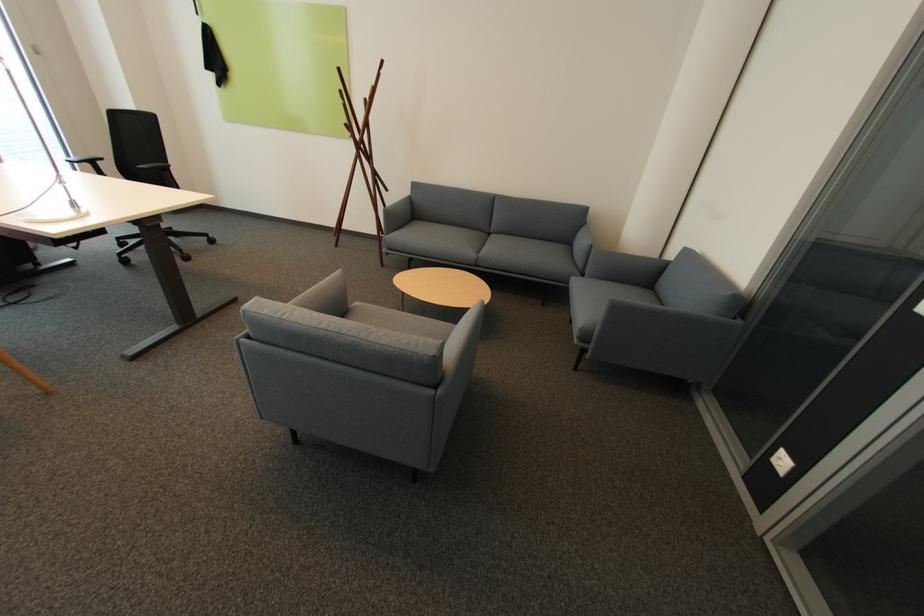
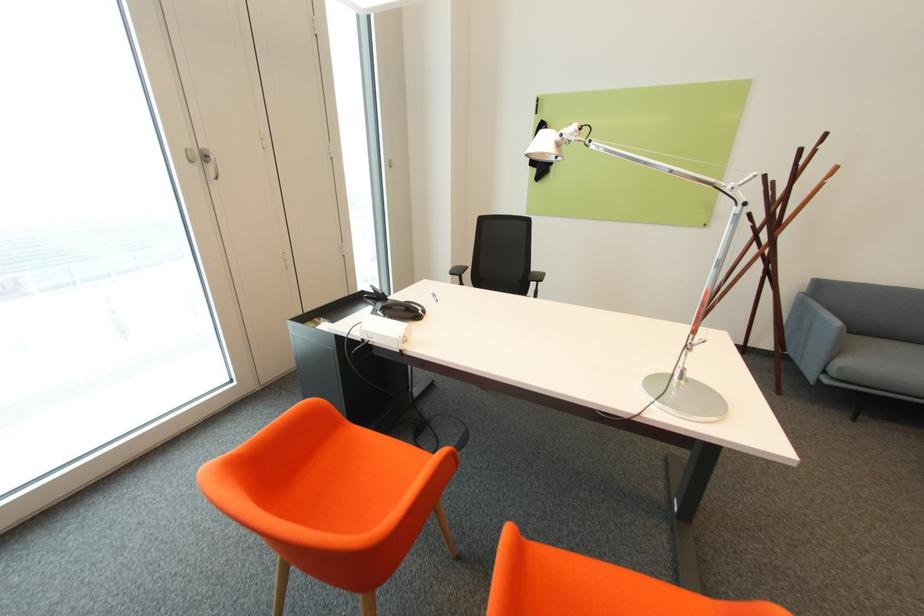
Question: The images are taken continuously from a first-person perspective. In which direction are you moving?

Choices:
 (A) Left
 (B) Right
 (C) Forward
 (D) Backward

Answer: (A)